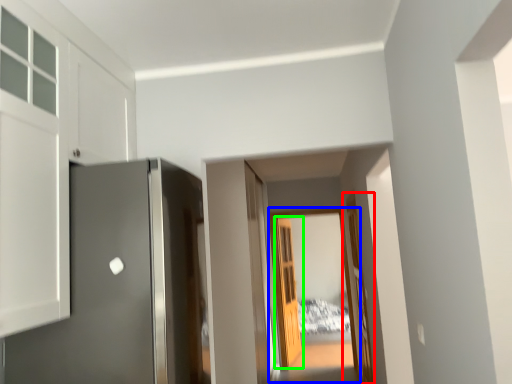
Question: Which object is the farthest from door (highlighted by a red box)? Choose among these: glass door (highlighted by a blue box) or door (highlighted by a green box).

Choices:
 (A) glass door
 (B) door

Answer: (B)